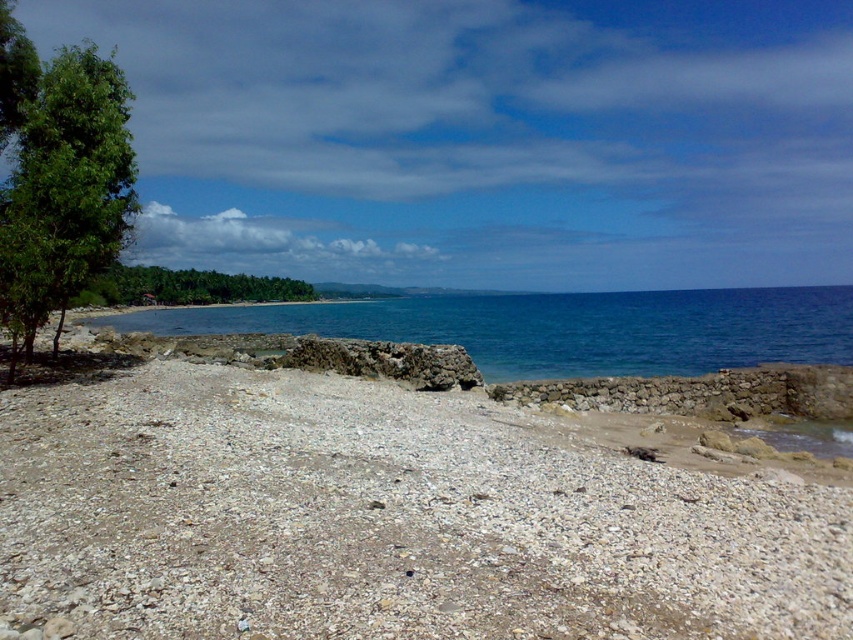
Who is positioned more to the left, gray gravel beach at center or green leafy trees at center?

From the viewer's perspective, green leafy trees at center appears more on the left side.

Based on the photo, who is shorter, gray gravel beach at center or green leafy trees at center?

Standing shorter between the two is gray gravel beach at center.

Which is behind, point (428, 483) or point (169, 280)?

Point (169, 280)

Locate an element on the screen. This screenshot has height=640, width=853. gray gravel beach at center is located at coordinates (386, 518).

This screenshot has height=640, width=853. What do you see at coordinates (561, 326) in the screenshot?
I see `blue clear water at center` at bounding box center [561, 326].

Is blue clear water at center bigger than green leafy trees at center?

Yes.

Is point (837, 342) positioned after point (215, 284)?

No, it is in front of (215, 284).

Identify the location of blue clear water at center. (561, 326).

Can you confirm if gray gravel beach at center is positioned to the left of blue clear water at center?

Yes, gray gravel beach at center is to the left of blue clear water at center.

Between point (648, 442) and point (343, 314), which one is positioned behind?

The point (343, 314) is behind.

Find the location of a particular element. The height and width of the screenshot is (640, 853). gray gravel beach at center is located at coordinates (386, 518).